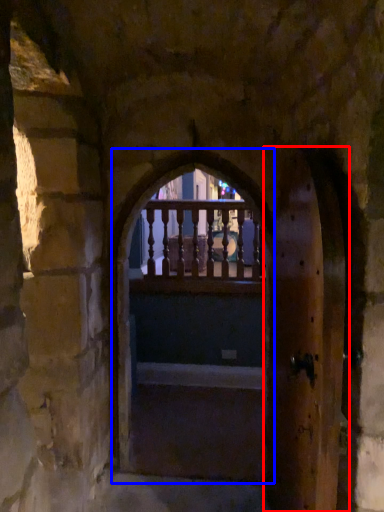
Question: Which object appears farthest to the camera in this image, screen door (highlighted by a red box) or window frame (highlighted by a blue box)?

Choices:
 (A) screen door
 (B) window frame

Answer: (B)